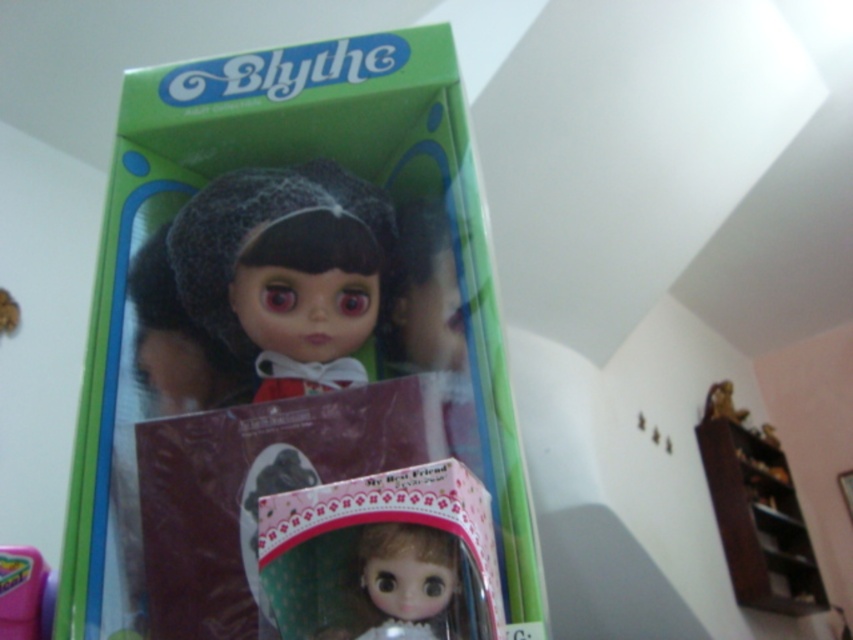
Question: Which of the following is the closest to the observer?

Choices:
 (A) (318, 248)
 (B) (16, 573)

Answer: (B)

Question: Does green plastic box at center appear on the left side of matte plastic toy at lower left?

Choices:
 (A) yes
 (B) no

Answer: (B)

Question: Which point appears farthest from the camera in this image?

Choices:
 (A) (396, 609)
 (B) (334, 339)
 (C) (0, 561)
 (D) (439, 451)

Answer: (B)

Question: Is satin black doll at center further to the viewer compared to shiny plastic doll at center?

Choices:
 (A) no
 (B) yes

Answer: (B)

Question: Does satin black doll at center appear under shiny plastic doll at center?

Choices:
 (A) no
 (B) yes

Answer: (A)

Question: Which point is farther from the camera taking this photo?

Choices:
 (A) (91, 596)
 (B) (338, 342)

Answer: (B)